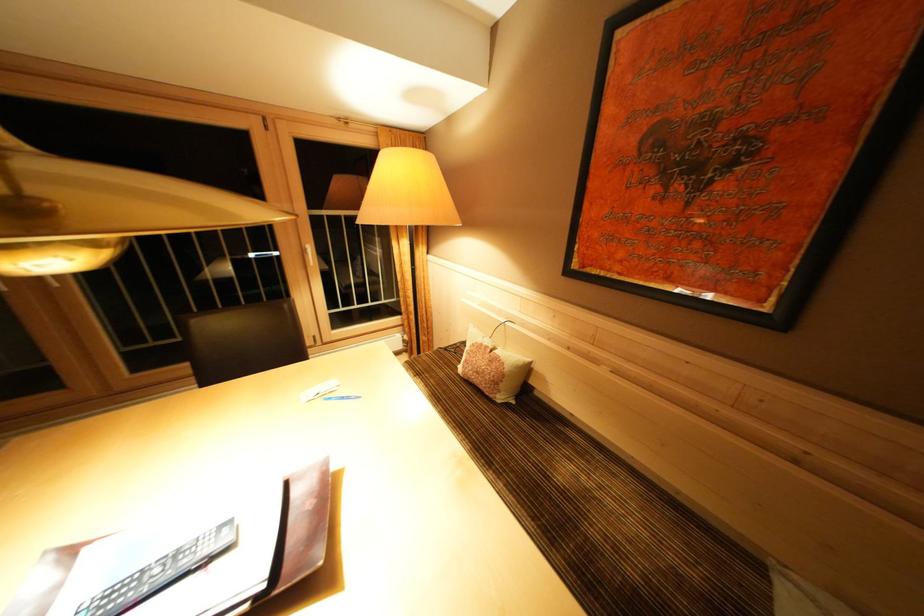
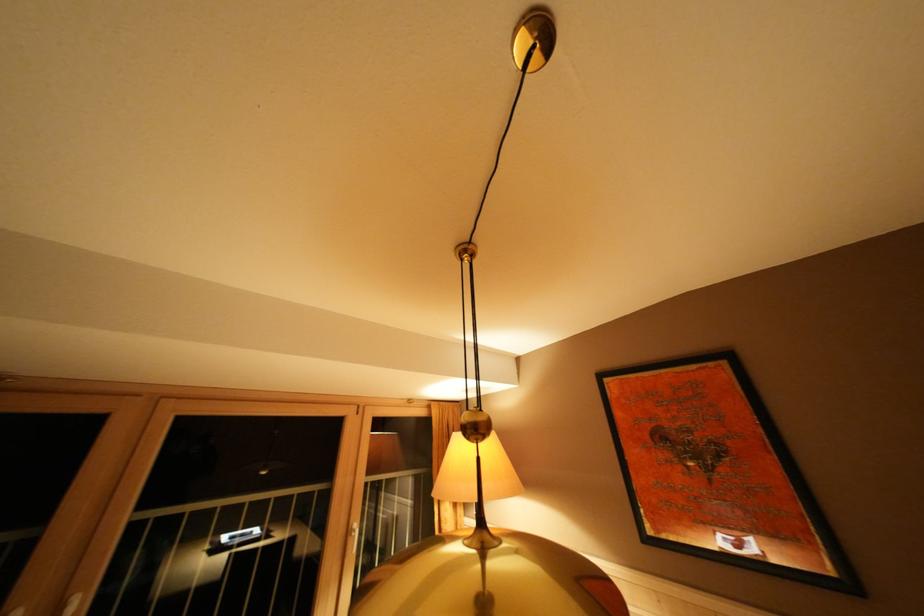
Find the pixel in the second image that matches the point at 310,256 in the first image.

(355, 537)